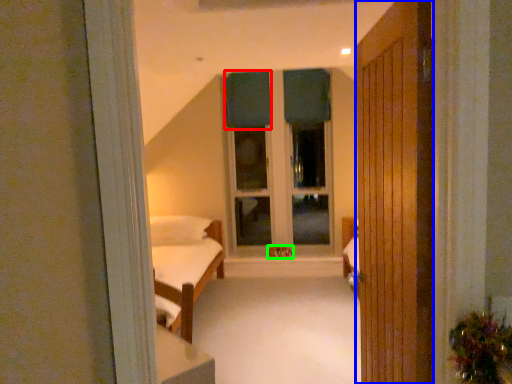
Question: Estimate the real-world distances between objects in this image. Which object is closer to curtain (highlighted by a red box), door (highlighted by a blue box) or toy (highlighted by a green box)?

Choices:
 (A) door
 (B) toy

Answer: (B)